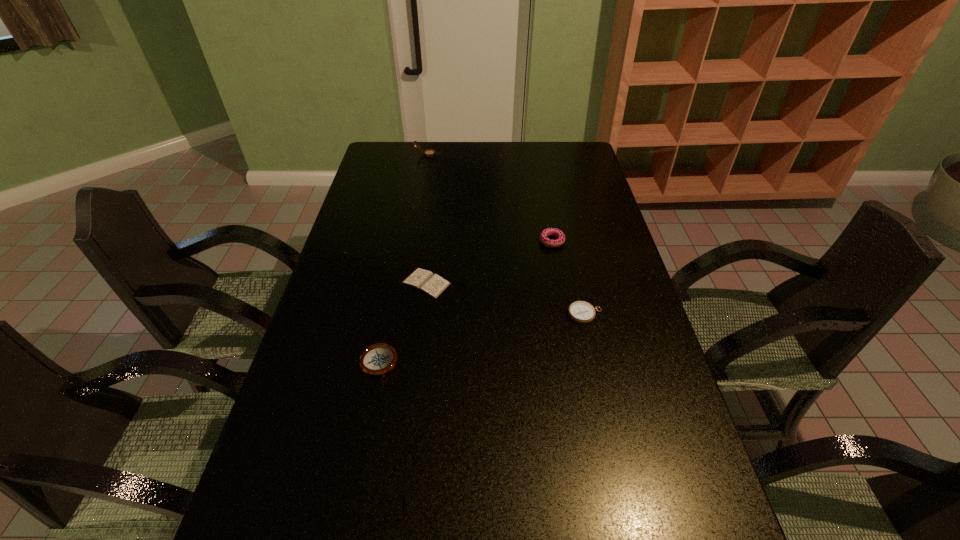
You are a GUI agent. You are given a task and a screenshot of the screen. Output one action in this format:
    pyautogui.click(x=<x>, y=<y>)
    Task: Click on the free space between the diary and the second nearest compass
    
    Given the screenshot: What is the action you would take?
    pyautogui.click(x=506, y=299)

Find the location of a particular element. Image resolution: width=960 pixels, height=540 pixels. free space that is in between the fourth shortest object and the shortest compass is located at coordinates (568, 278).

Identify the location of free spot between the shortest compass and the nearest object. The image size is (960, 540). (482, 339).

Find the location of a particular element. The image size is (960, 540). object that is the second closest to the shortest compass is located at coordinates (433, 285).

Select which object appears as the third closest to the farthest object. Please provide its 2D coordinates. Your answer should be formatted as a tuple, i.e. [(x, y)], where the tuple contains the x and y coordinates of a point satisfying the conditions above.

[(582, 312)]

The height and width of the screenshot is (540, 960). Find the location of `the third closest compass to the doughnut`. the third closest compass to the doughnut is located at coordinates (428, 153).

You are a GUI agent. You are given a task and a screenshot of the screen. Output one action in this format:
    pyautogui.click(x=<x>, y=<y>)
    Task: Click on the compass identified as the closest to the farthest compass
    
    Given the screenshot: What is the action you would take?
    pyautogui.click(x=582, y=312)

This screenshot has width=960, height=540. Find the location of `free space in the image that satisfies the following two spatial constraints: 1. on the back side of the second tallest object; 2. on the left side of the shortest object`. free space in the image that satisfies the following two spatial constraints: 1. on the back side of the second tallest object; 2. on the left side of the shortest object is located at coordinates pyautogui.click(x=432, y=241).

Where is `free space that satisfies the following two spatial constraints: 1. on the back side of the diary; 2. on the face of the tallest object`? This screenshot has width=960, height=540. free space that satisfies the following two spatial constraints: 1. on the back side of the diary; 2. on the face of the tallest object is located at coordinates (443, 154).

Find the location of a particular element. The height and width of the screenshot is (540, 960). vacant space that satisfies the following two spatial constraints: 1. on the face of the tallest compass; 2. on the front side of the third shortest object is located at coordinates (392, 363).